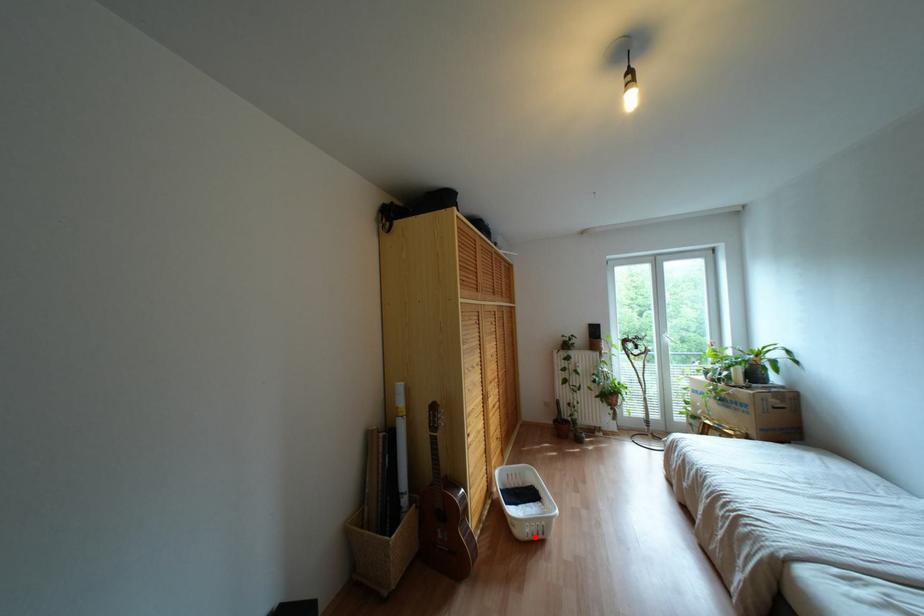
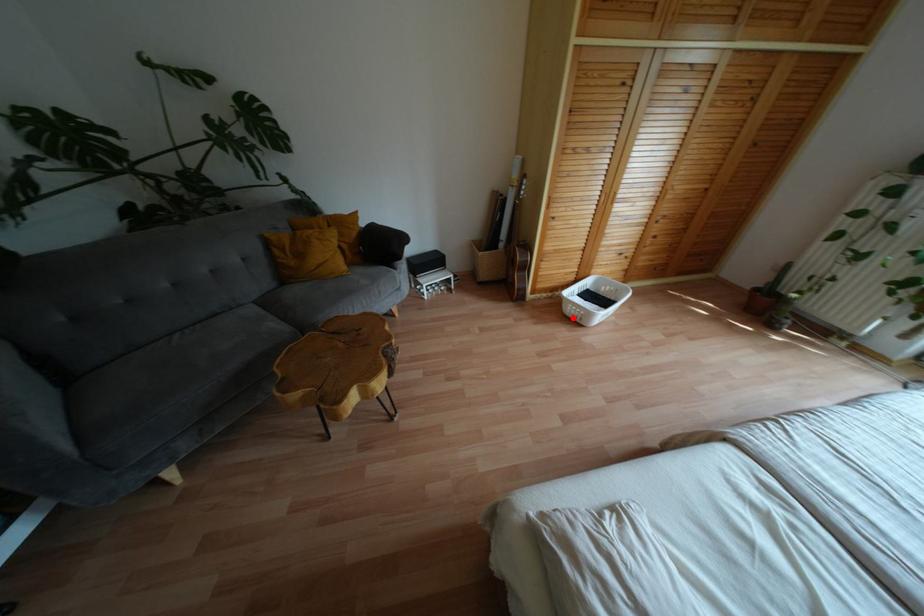
I am providing you with two images of the same scene from different viewpoints. A red point is marked on the first image and another point is marked on the second image. Is the red point in image1 aligned with the point shown in image2?

Yes